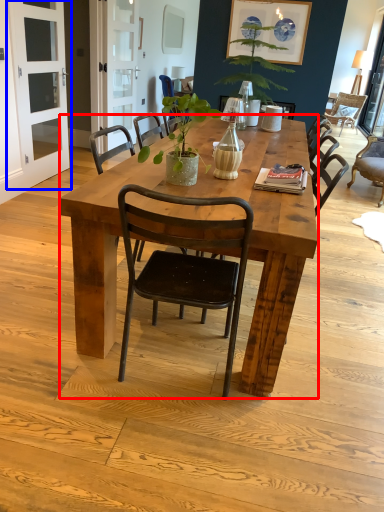
Question: Which of the following is the closest to the observer, desk (highlighted by a red box) or screen door (highlighted by a blue box)?

Choices:
 (A) desk
 (B) screen door

Answer: (A)